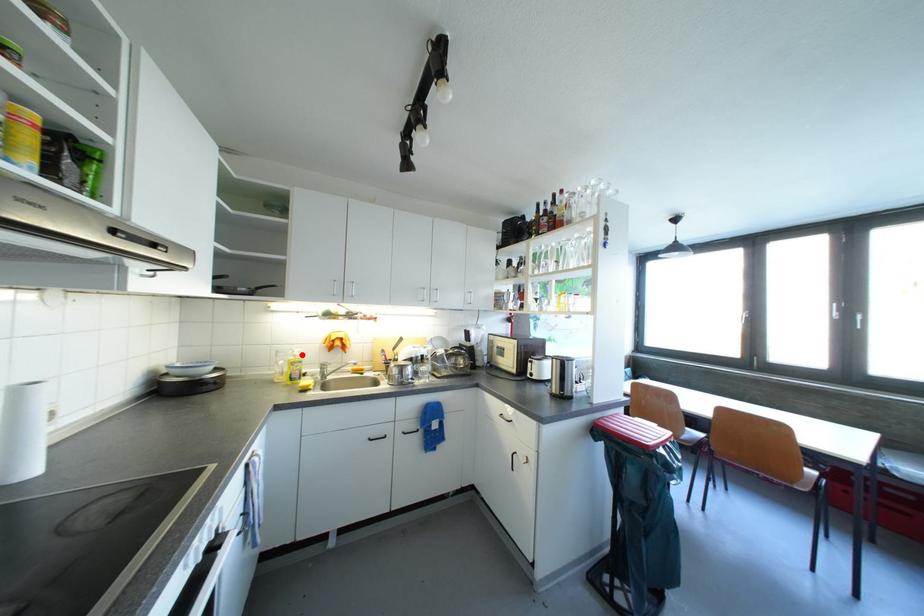
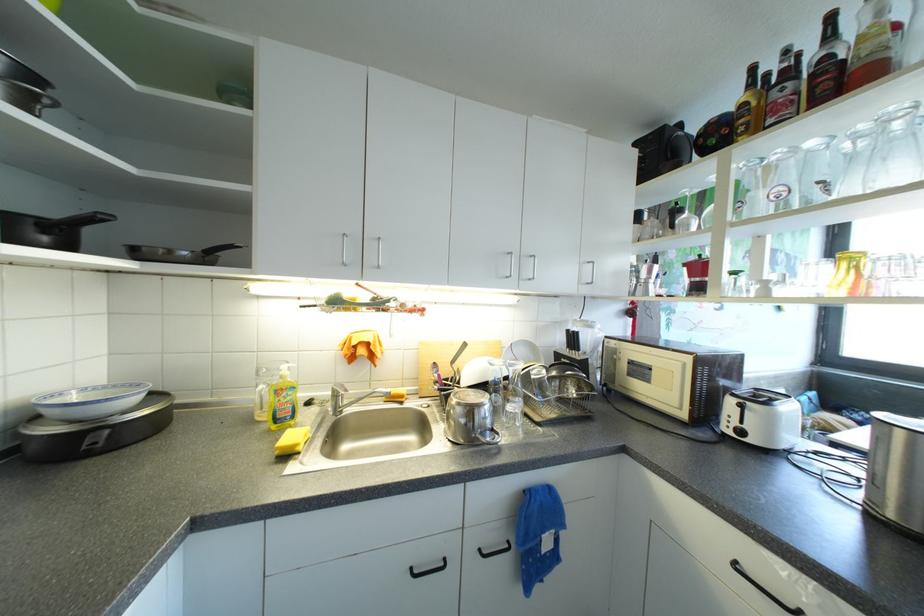
Find the pixel in the second image that matches the highlighted location in the first image.

(290, 373)